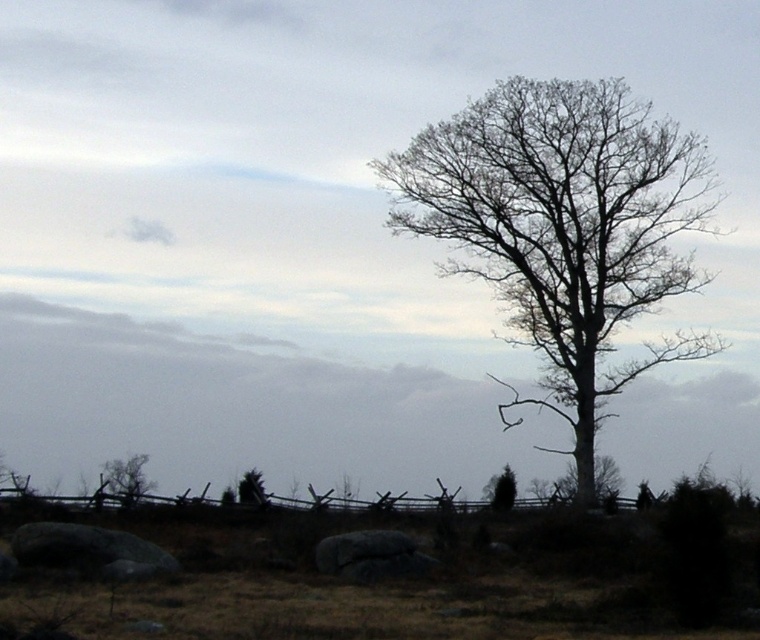
Consider the image. How distant is gray rough stone at lower center from green matte tree at lower left?

A distance of 20.60 meters exists between gray rough stone at lower center and green matte tree at lower left.

Does gray rough stone at lower center lie behind green matte tree at lower left?

No, gray rough stone at lower center is closer to the viewer.

Between point (388, 540) and point (258, 477), which one is positioned behind?

Positioned behind is point (258, 477).

Identify the location of gray rough stone at lower center. The width and height of the screenshot is (760, 640). (369, 556).

Can you confirm if gray rough stone at lower left is smaller than gray rough stone at lower center?

Incorrect, gray rough stone at lower left is not smaller in size than gray rough stone at lower center.

Is gray rough stone at lower left to the left of gray rough stone at lower center from the viewer's perspective?

Indeed, gray rough stone at lower left is positioned on the left side of gray rough stone at lower center.

The image size is (760, 640). Describe the element at coordinates (89, 548) in the screenshot. I see `gray rough stone at lower left` at that location.

The image size is (760, 640). Find the location of `gray rough stone at lower left`. gray rough stone at lower left is located at coordinates (89, 548).

Which is in front, point (553, 380) or point (325, 572)?

Point (325, 572)

Is bare wood tree at center thinner than gray rough stone at lower center?

In fact, bare wood tree at center might be wider than gray rough stone at lower center.

You are a GUI agent. You are given a task and a screenshot of the screen. Output one action in this format:
    pyautogui.click(x=<x>, y=<y>)
    Task: Click on the bare wood tree at center
    
    Given the screenshot: What is the action you would take?
    pyautogui.click(x=562, y=228)

Where is `bare wood tree at center`? This screenshot has width=760, height=640. bare wood tree at center is located at coordinates (562, 228).